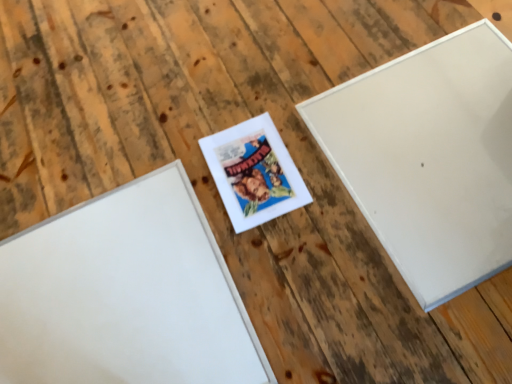
Where is `vacant area situated below matte white picture frame at center, the second picture frame from the left (from a real-world perspective)`? This screenshot has height=384, width=512. vacant area situated below matte white picture frame at center, the second picture frame from the left (from a real-world perspective) is located at coordinates (256, 173).